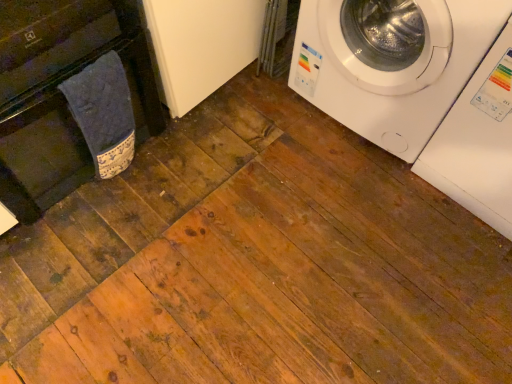
Question: Based on their sizes in the image, would you say black matte dishwasher at left is bigger or smaller than white glossy washing machine at upper right, the 2th washing machine viewed from the left?

Choices:
 (A) big
 (B) small

Answer: (A)

Question: From the image's perspective, is black matte dishwasher at left positioned above or below white glossy washing machine at upper right, the 2th washing machine viewed from the left?

Choices:
 (A) above
 (B) below

Answer: (A)

Question: Based on their relative distances, which object is farther from the blue fabric towel at left?

Choices:
 (A) black matte dishwasher at left
 (B) white glossy washing machine at upper right, which is the 2th washing machine in right-to-left order
 (C) white glossy washing machine at upper right, the 1th washing machine viewed from the right

Answer: (C)

Question: Which object is the closest to the blue fabric towel at left?

Choices:
 (A) black matte dishwasher at left
 (B) white glossy washing machine at upper right, the 1th washing machine viewed from the right
 (C) white glossy washing machine at upper right, acting as the 1th washing machine starting from the left

Answer: (A)